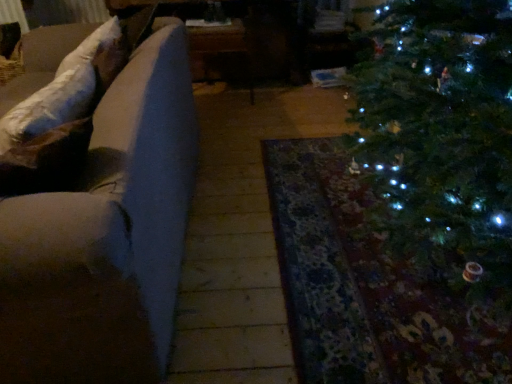
Locate an element on the screen. This screenshot has width=512, height=384. velvet beige couch at left is located at coordinates (106, 237).

Describe the element at coordinates (106, 237) in the screenshot. I see `velvet beige couch at left` at that location.

Measure the distance between point (150,175) and camera.

1.14 meters.

The width and height of the screenshot is (512, 384). What are the coordinates of `velvet beige couch at left` in the screenshot? It's located at (106, 237).